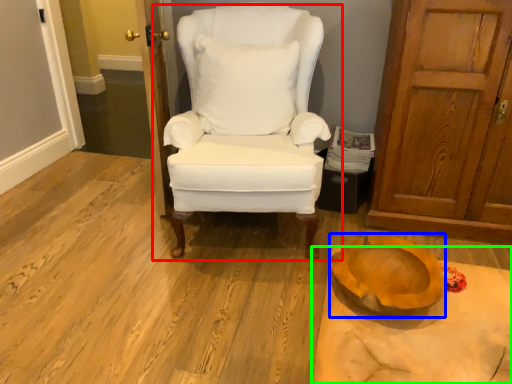
Question: Which is nearer to the chair (highlighted by a red box)? oval (highlighted by a blue box) or table (highlighted by a green box).

Choices:
 (A) oval
 (B) table

Answer: (A)